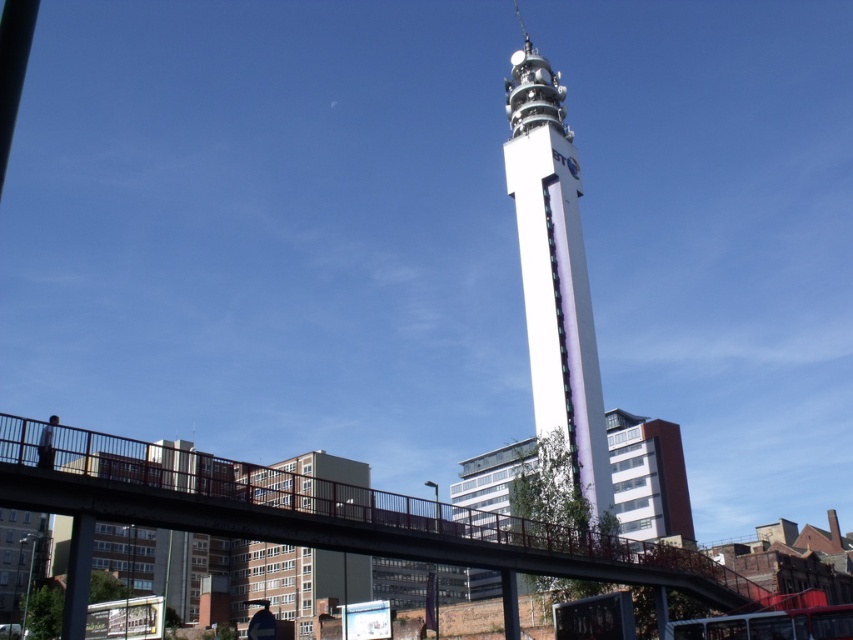
You are a city planner evaluating the urban landscape. You need to determine if the white smooth tower at center and the metallic silver helmet at lower left can both be seen from a nearby observation deck. Considering their heights, which one will appear taller?

The white smooth tower at center has a greater height compared to the metallic silver helmet at lower left, so it will appear taller from the observation deck.

You are a construction worker standing on the pedestrian bridge and see the white smooth tower at center and the metallic silver helmet at lower left. Which object is positioned to the right of the other?

The white smooth tower at center is to the right of metallic silver helmet at lower left.